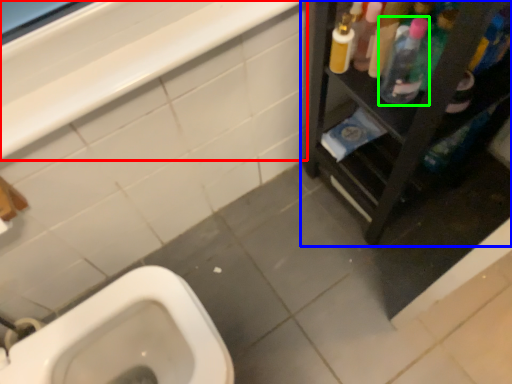
Question: Which object is the closest to the balustrade (highlighted by a red box)? Choose among these: furniture (highlighted by a blue box) or cleaning product (highlighted by a green box).

Choices:
 (A) furniture
 (B) cleaning product

Answer: (B)